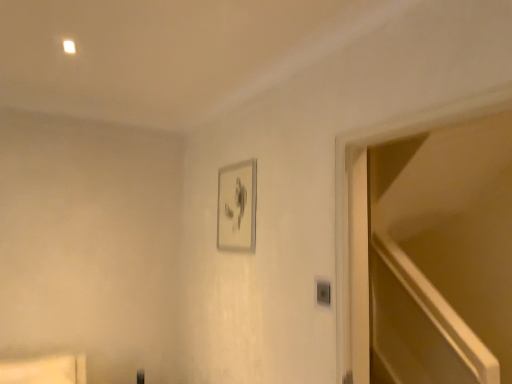
Question: From the image's perspective, is silver metallic picture frame at upper center below matte wood shelf at lower left?

Choices:
 (A) yes
 (B) no

Answer: (B)

Question: Is silver metallic picture frame at upper center oriented away from matte wood shelf at lower left?

Choices:
 (A) yes
 (B) no

Answer: (B)

Question: Is matte wood shelf at lower left located within silver metallic picture frame at upper center?

Choices:
 (A) no
 (B) yes

Answer: (A)

Question: From a real-world perspective, is silver metallic picture frame at upper center under matte wood shelf at lower left?

Choices:
 (A) yes
 (B) no

Answer: (B)

Question: Can you confirm if silver metallic picture frame at upper center is shorter than matte wood shelf at lower left?

Choices:
 (A) yes
 (B) no

Answer: (B)

Question: From a real-world perspective, is silver metallic picture frame at upper center above or below transparent glass door at right?

Choices:
 (A) below
 (B) above

Answer: (B)

Question: Looking at their shapes, would you say silver metallic picture frame at upper center is wider or thinner than transparent glass door at right?

Choices:
 (A) wide
 (B) thin

Answer: (B)

Question: In terms of size, does silver metallic picture frame at upper center appear bigger or smaller than transparent glass door at right?

Choices:
 (A) big
 (B) small

Answer: (B)

Question: Is point (223, 238) positioned closer to the camera than point (425, 264)?

Choices:
 (A) farther
 (B) closer

Answer: (B)

Question: In terms of width, does silver metallic picture frame at upper center look wider or thinner when compared to matte wood shelf at lower left?

Choices:
 (A) wide
 (B) thin

Answer: (B)

Question: Relative to matte wood shelf at lower left, is silver metallic picture frame at upper center in front or behind?

Choices:
 (A) front
 (B) behind

Answer: (B)

Question: Is silver metallic picture frame at upper center spatially inside matte wood shelf at lower left, or outside of it?

Choices:
 (A) inside
 (B) outside

Answer: (B)

Question: In the image, is silver metallic picture frame at upper center on the left side or the right side of matte wood shelf at lower left?

Choices:
 (A) left
 (B) right

Answer: (B)

Question: From a real-world perspective, is matte wood shelf at lower left above or below silver metallic picture frame at upper center?

Choices:
 (A) below
 (B) above

Answer: (A)

Question: Does point (61, 382) appear closer or farther from the camera than point (226, 225)?

Choices:
 (A) farther
 (B) closer

Answer: (B)